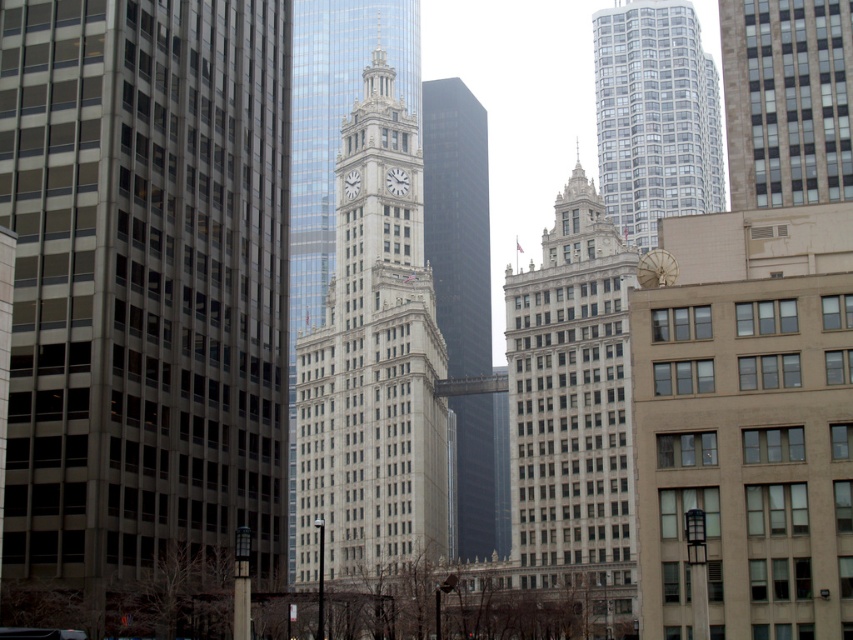
How far apart are gray concrete skyscraper at left and shiny glass skyscraper at center?

gray concrete skyscraper at left is 72.04 meters away from shiny glass skyscraper at center.

Does gray concrete skyscraper at left have a lesser width compared to shiny glass skyscraper at center?

No.

Who is more distant from viewer, (184,433) or (473,442)?

The point (473,442) is more distant.

Locate an element on the screen. The image size is (853, 640). gray concrete skyscraper at left is located at coordinates (144, 284).

Does gray concrete skyscraper at left come in front of white stone clock tower at center?

Yes, gray concrete skyscraper at left is in front of white stone clock tower at center.

Is point (242, 212) positioned behind point (364, 497)?

No.

This screenshot has height=640, width=853. Identify the location of gray concrete skyscraper at left. (144, 284).

Can you confirm if white stone building at center is positioned to the right of shiny glass skyscraper at center?

Yes, white stone building at center is to the right of shiny glass skyscraper at center.

Between white stone building at center and shiny glass skyscraper at center, which one appears on the left side from the viewer's perspective?

shiny glass skyscraper at center

Is point (576, 301) less distant than point (448, 348)?

Yes, it is in front of point (448, 348).

Find the location of `white stone building at center`. white stone building at center is located at coordinates (573, 412).